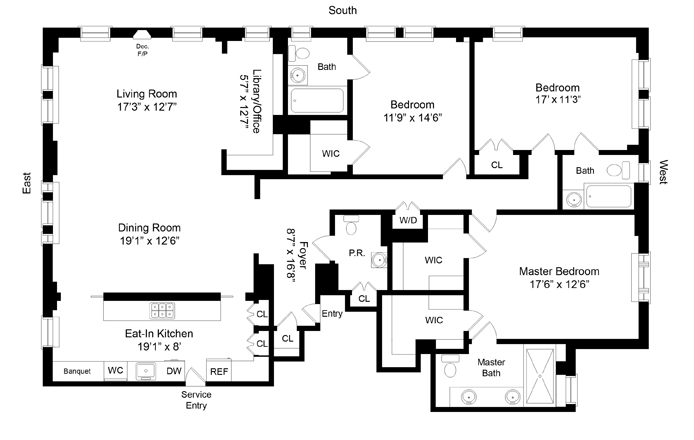
The height and width of the screenshot is (440, 694). What are the coordinates of `living room` in the screenshot? It's located at (121, 128).